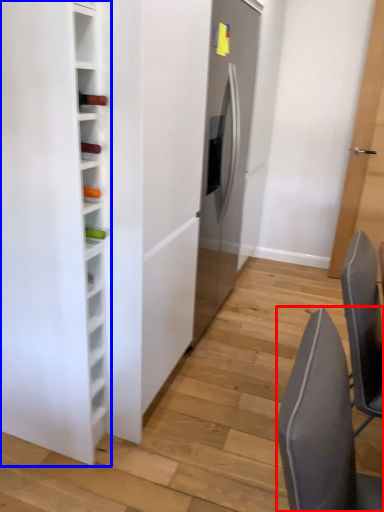
Question: Among these objects, which one is farthest to the camera, chair (highlighted by a red box) or furniture (highlighted by a blue box)?

Choices:
 (A) chair
 (B) furniture

Answer: (B)